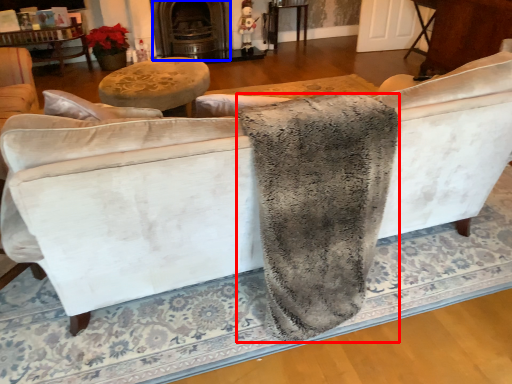
Question: Which object is further to the camera taking this photo, blanket (highlighted by a red box) or fireplace (highlighted by a blue box)?

Choices:
 (A) blanket
 (B) fireplace

Answer: (B)